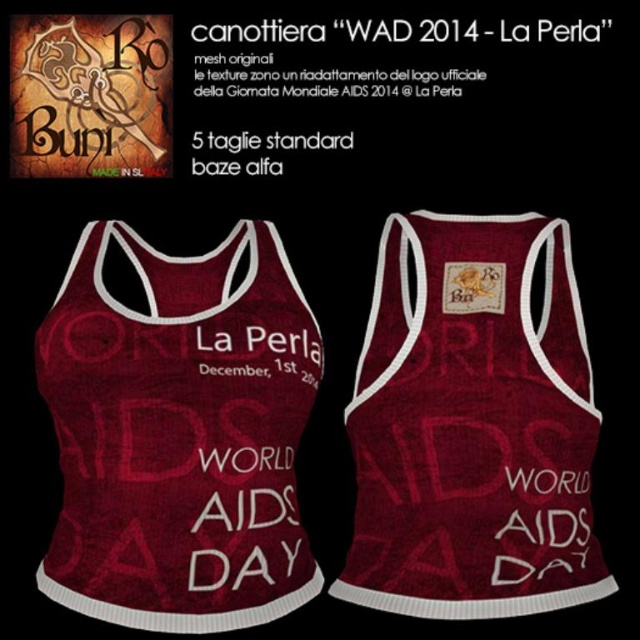
You are examining the front view of the tank top and notice two points marked on it. Which point is closer to you, point (516,481) or point (253,44)?

Point (516,481) is closer to the viewer than point (253,44).

You are a fashion designer looking at the promotional advertisement for the tank top. You notice two descriptions of the same garment at the center of the image. Which one is positioned lower between the burgundy textured tank top at center and the burgundy knitted tank top at center?

The burgundy textured tank top at center is located below the burgundy knitted tank top at center, so the textured one is positioned lower.